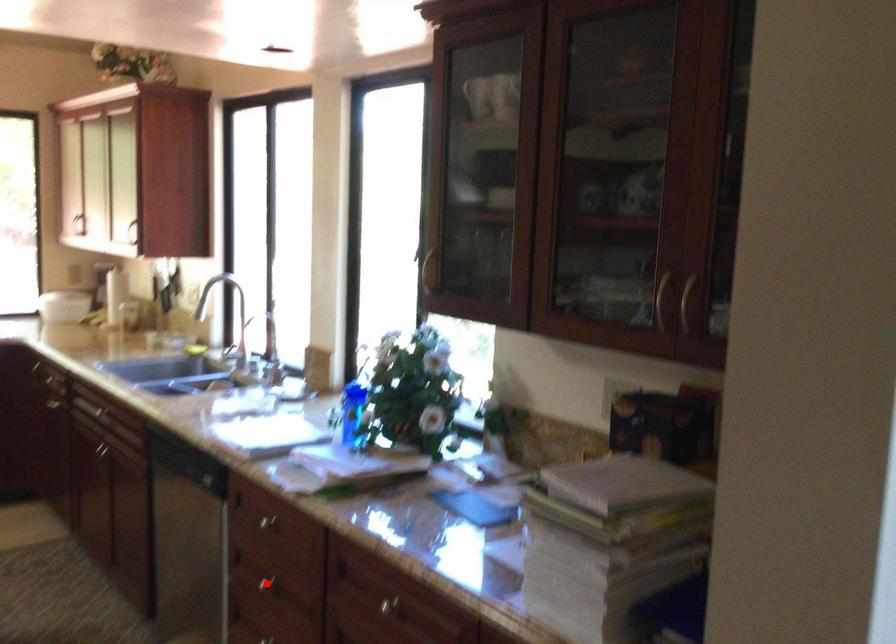
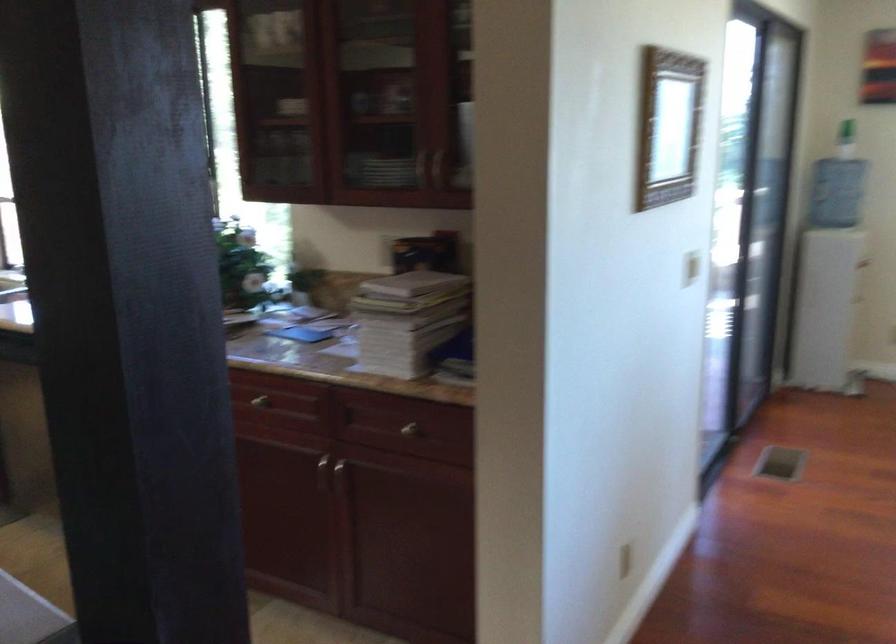
Question: I am providing you with two images of the same scene from different viewpoints. A red point is marked on the first image. Can you still see the location of the red point in image 2?

Choices:
 (A) Yes
 (B) No

Answer: (B)